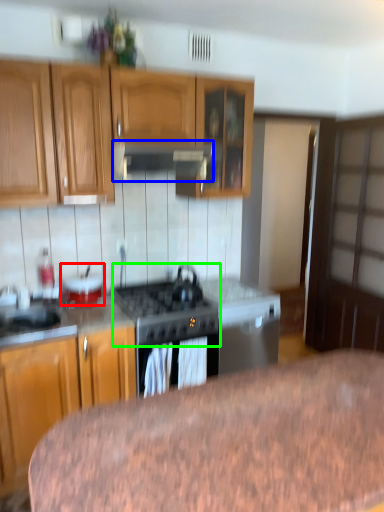
Question: Which is farther away from appliance (highlighted by a red box)? exhaust hood (highlighted by a blue box) or gas stove (highlighted by a green box)?

Choices:
 (A) exhaust hood
 (B) gas stove

Answer: (A)